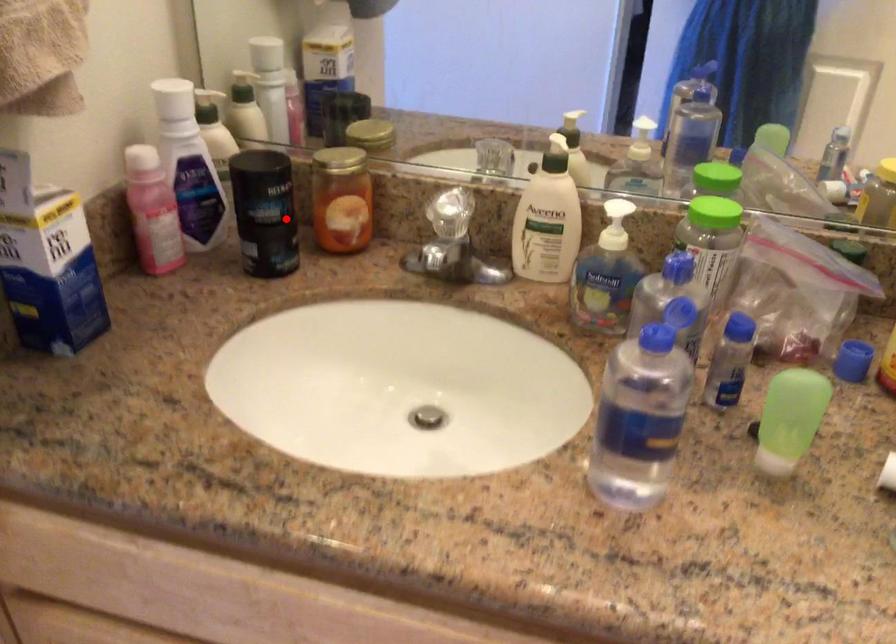
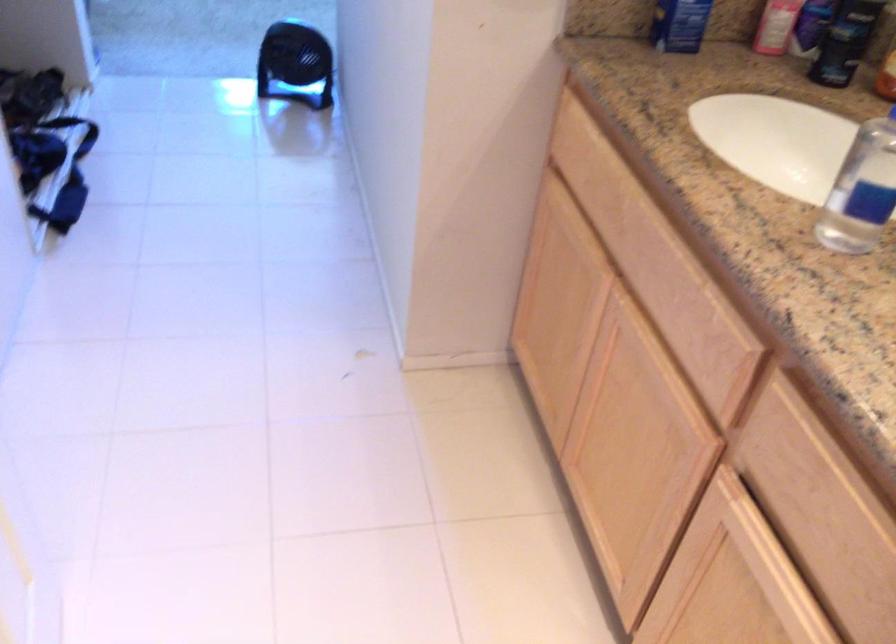
Find the pixel in the second image that matches the highlighted location in the first image.

(845, 41)